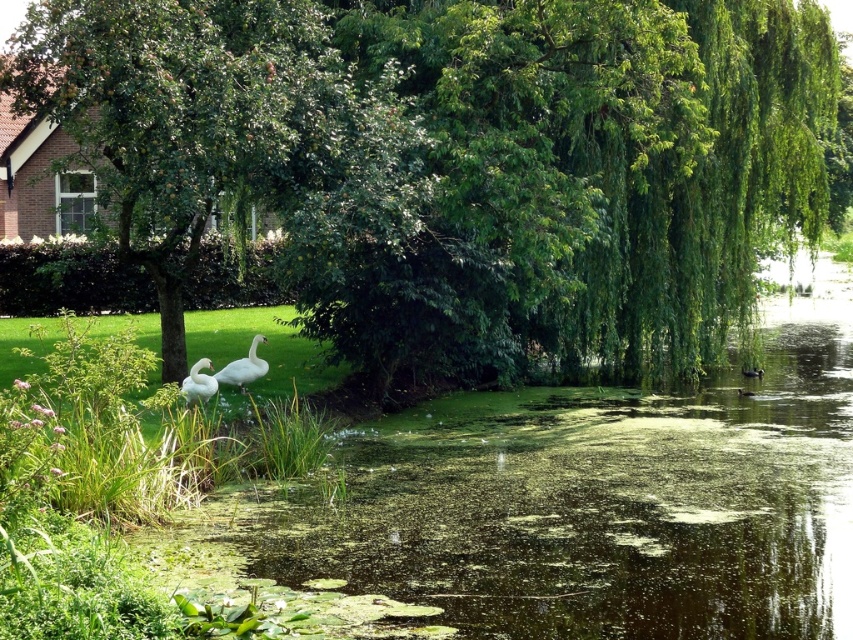
Question: Which point is closer to the camera?

Choices:
 (A) (236, 385)
 (B) (817, 163)
 (C) (381, 625)
 (D) (195, 387)

Answer: (C)

Question: Does green leafy tree at center appear on the left side of white glossy swan at lower left?

Choices:
 (A) no
 (B) yes

Answer: (A)

Question: Is green algae-covered water at center-left positioned behind white feathered swan at lower left?

Choices:
 (A) yes
 (B) no

Answer: (B)

Question: Which object is closer to the camera taking this photo?

Choices:
 (A) green algae-covered water at center-left
 (B) white glossy swan at lower left
 (C) white feathered swan at lower left
 (D) green leafy tree at center

Answer: (A)

Question: Which object appears closest to the camera in this image?

Choices:
 (A) white feathered swan at lower left
 (B) green leafy tree at center

Answer: (B)

Question: Is the position of green leafy tree at center more distant than that of white glossy swan at lower left?

Choices:
 (A) no
 (B) yes

Answer: (A)